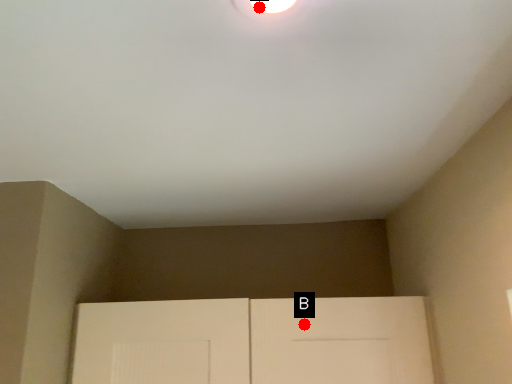
Question: Two points are circled on the image, labeled by A and B beside each circle. Among these points, which one is nearest to the camera?

Choices:
 (A) A is closer
 (B) B is closer

Answer: (A)